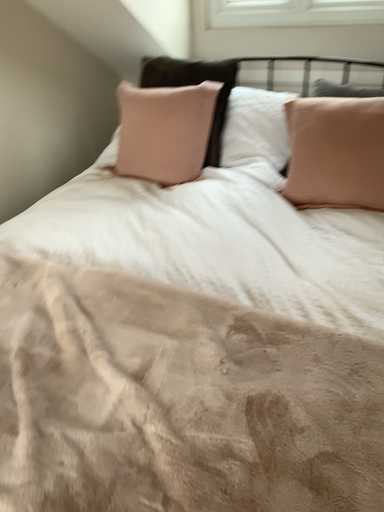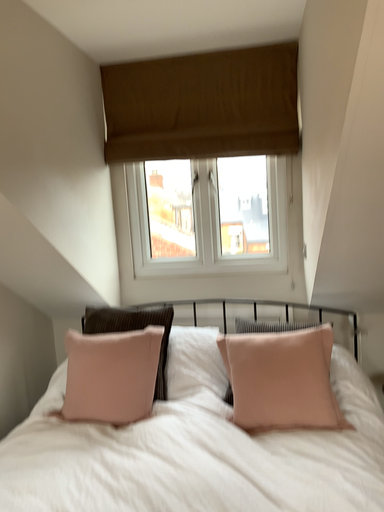
Question: Which way did the camera rotate in the video?

Choices:
 (A) rotated downward
 (B) rotated upward

Answer: (B)